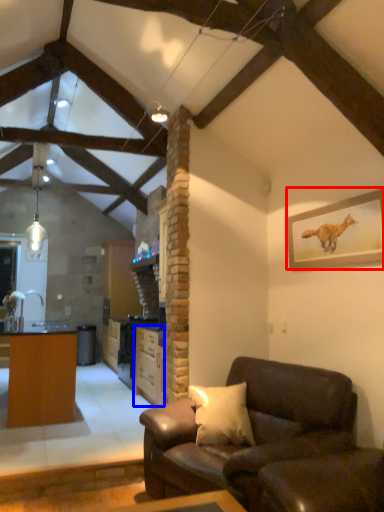
Question: Which object is further to the camera taking this photo, picture frame (highlighted by a red box) or cabinetry (highlighted by a blue box)?

Choices:
 (A) picture frame
 (B) cabinetry

Answer: (B)